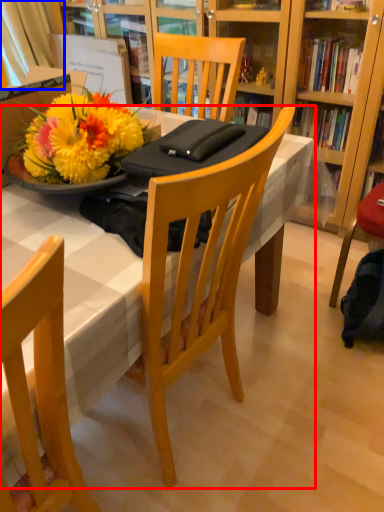
Question: Which object appears closest to the camera in this image, desk (highlighted by a red box) or curtain (highlighted by a blue box)?

Choices:
 (A) desk
 (B) curtain

Answer: (A)